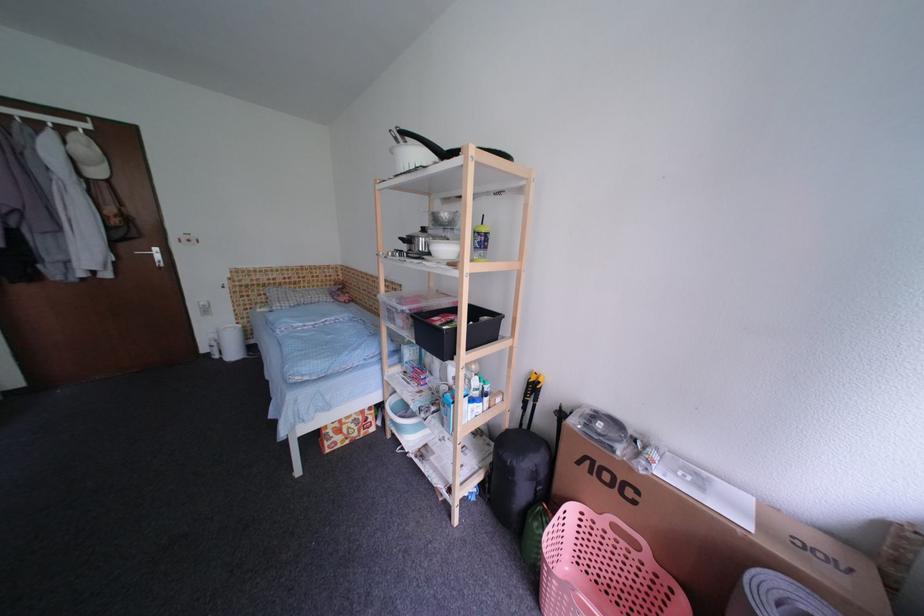
The image size is (924, 616). I want to click on rolled yoga mat, so click(x=774, y=596).